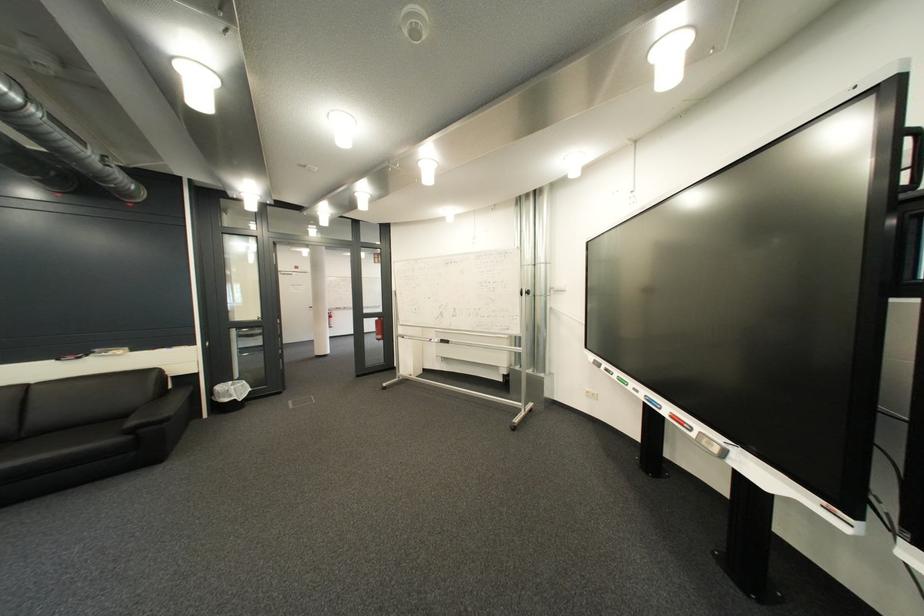
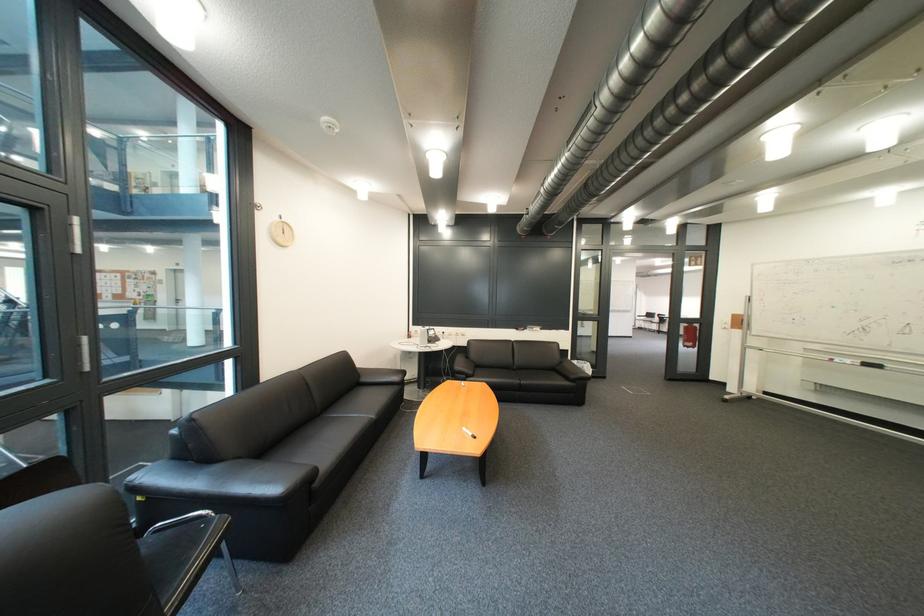
In the second image, find the point that corresponds to the point at 456,342 in the first image.

(881, 366)